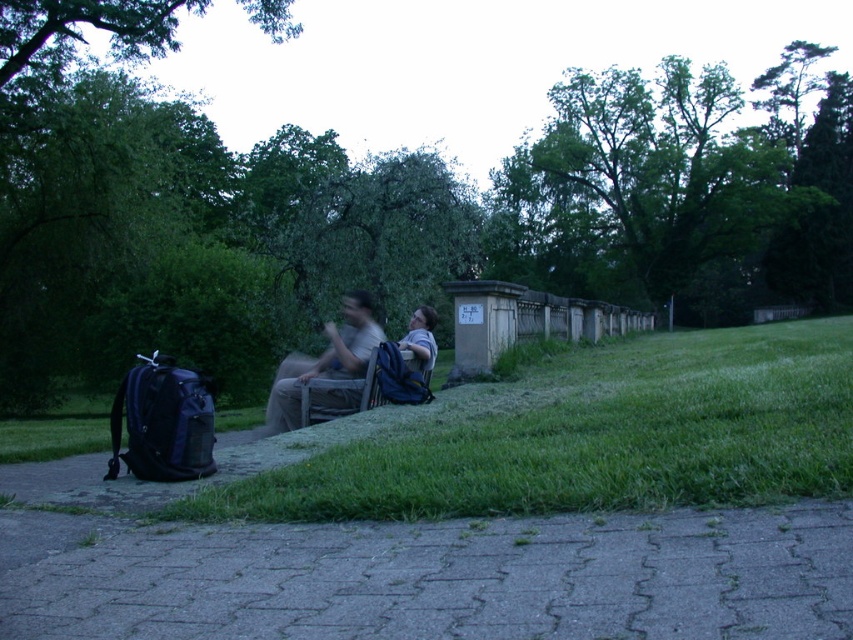
Question: Is gray concrete pavement at lower center smaller than matte gray shirt at center?

Choices:
 (A) yes
 (B) no

Answer: (B)

Question: Can you confirm if green grass at lower center is positioned to the right of matte gray shirt at center?

Choices:
 (A) yes
 (B) no

Answer: (A)

Question: Which of the following is the closest to the observer?

Choices:
 (A) gray concrete pavement at lower center
 (B) green grass at lower center

Answer: (A)

Question: Is gray concrete pavement at lower center positioned at the back of matte gray shirt at center?

Choices:
 (A) yes
 (B) no

Answer: (B)

Question: Which point is farther to the camera?

Choices:
 (A) (727, 528)
 (B) (351, 349)
 (C) (775, 362)

Answer: (C)

Question: Based on their relative distances, which object is farther from the matte gray shirt at center?

Choices:
 (A) green grass at lower center
 (B) gray concrete pavement at lower center

Answer: (A)